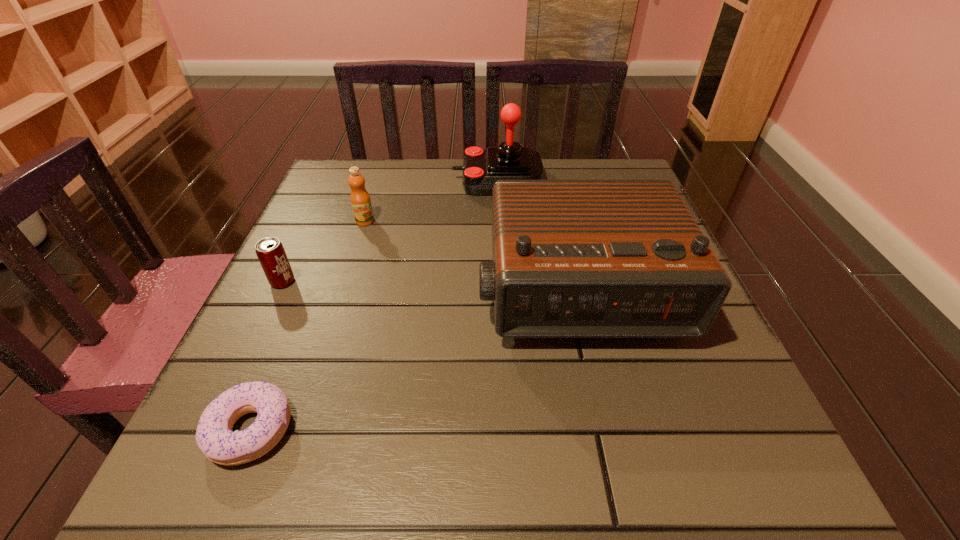
I want to click on joystick, so click(481, 168).

In order to click on radio receiver in this screenshot , I will do `click(571, 258)`.

Locate an element on the screen. The image size is (960, 540). the third shortest object is located at coordinates (360, 200).

Find the location of a particular element. the second farthest object is located at coordinates (360, 200).

Find the location of a particular element. beer can is located at coordinates (271, 254).

You are a GUI agent. You are given a task and a screenshot of the screen. Output one action in this format:
    pyautogui.click(x=<x>, y=<y>)
    Task: Click on the nearest object
    Image resolution: width=960 pixels, height=540 pixels.
    Given the screenshot: What is the action you would take?
    pyautogui.click(x=214, y=436)

I want to click on the shortest object, so click(x=214, y=436).

Locate an element on the screen. Image resolution: width=960 pixels, height=540 pixels. vacant area situated on the base of the joystick is located at coordinates (417, 180).

What are the coordinates of `free space located on the base of the joystick` in the screenshot? It's located at (333, 180).

You are a GUI agent. You are given a task and a screenshot of the screen. Output one action in this format:
    pyautogui.click(x=<x>, y=<y>)
    Task: Click on the free space located on the base of the joystick
    
    Given the screenshot: What is the action you would take?
    (377, 180)